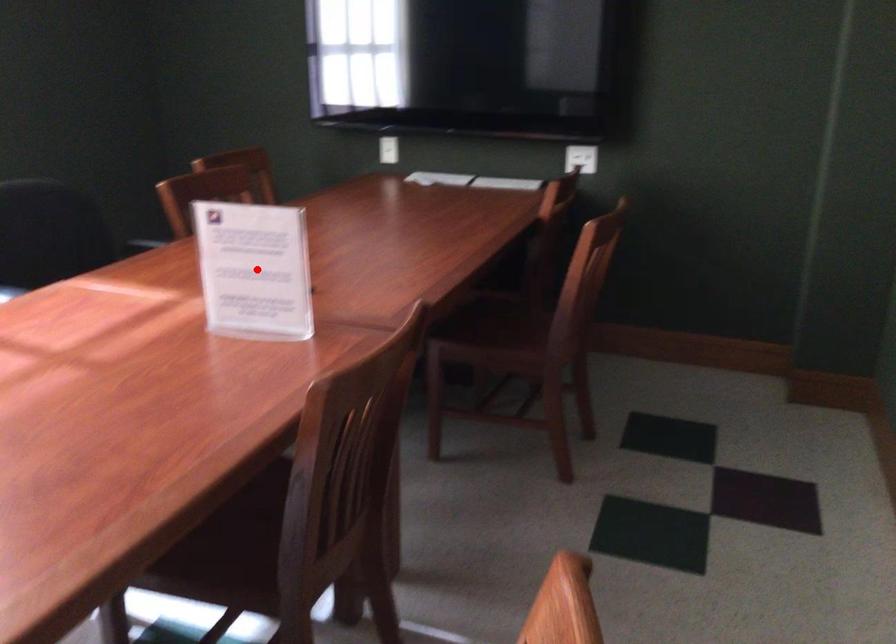
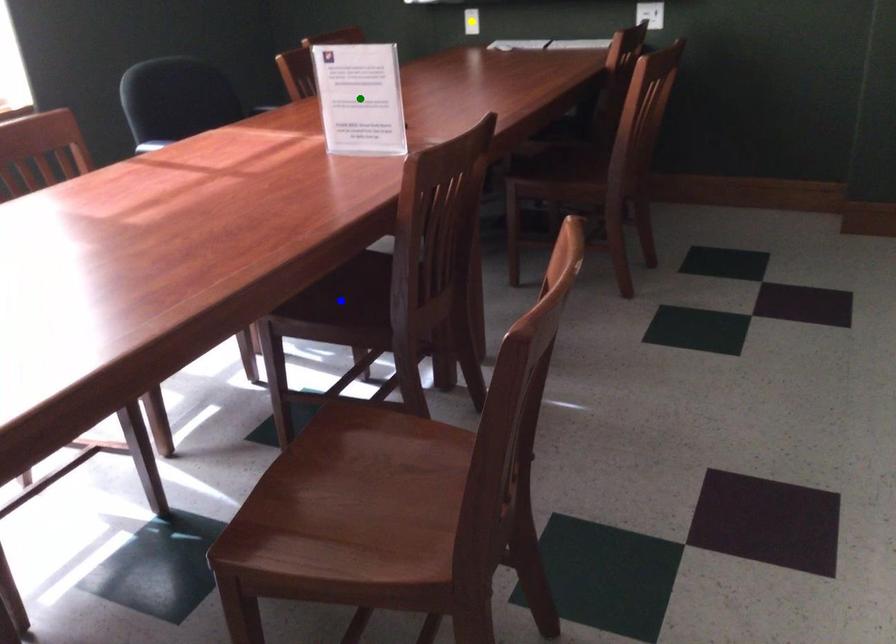
Question: I am providing you with two images of the same scene from different viewpoints. A red point is marked on the first image. You are given multiple points on the second image. Which mark in image 2 goes with the point in image 1?

Choices:
 (A) green point
 (B) yellow point
 (C) blue point

Answer: (A)